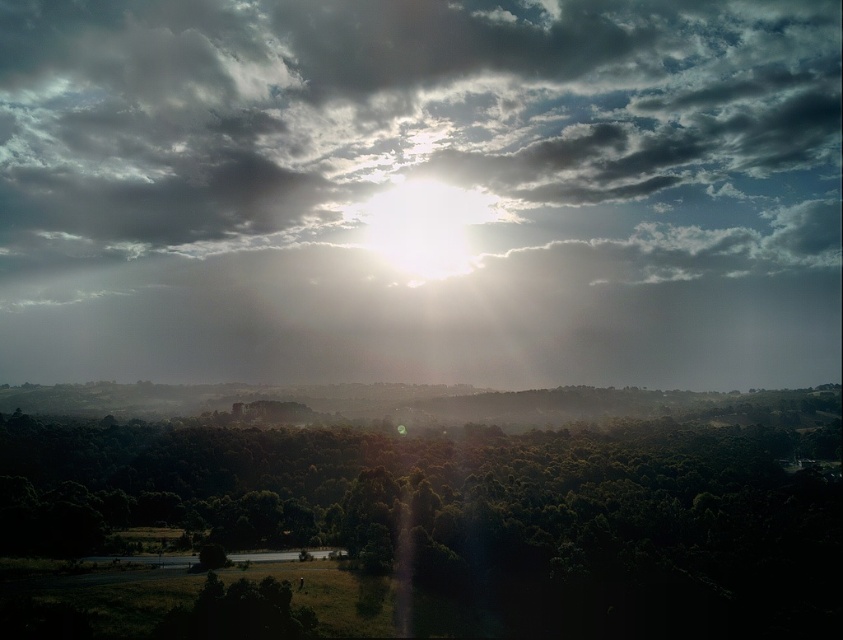
Question: Which of the following is the farthest from the observer?

Choices:
 (A) (435, 490)
 (B) (790, 349)

Answer: (B)

Question: Observing the image, what is the correct spatial positioning of cloudy at upper center in reference to green leafy tree at center?

Choices:
 (A) above
 (B) below

Answer: (A)

Question: Which point appears closest to the camera in this image?

Choices:
 (A) (728, 420)
 (B) (600, 29)

Answer: (A)

Question: Is cloudy at upper center thinner than green leafy tree at center?

Choices:
 (A) yes
 (B) no

Answer: (B)

Question: Which object is closer to the camera taking this photo?

Choices:
 (A) cloudy at upper center
 (B) green leafy tree at center

Answer: (B)

Question: Observing the image, what is the correct spatial positioning of cloudy at upper center in reference to green leafy tree at center?

Choices:
 (A) left
 (B) right

Answer: (A)